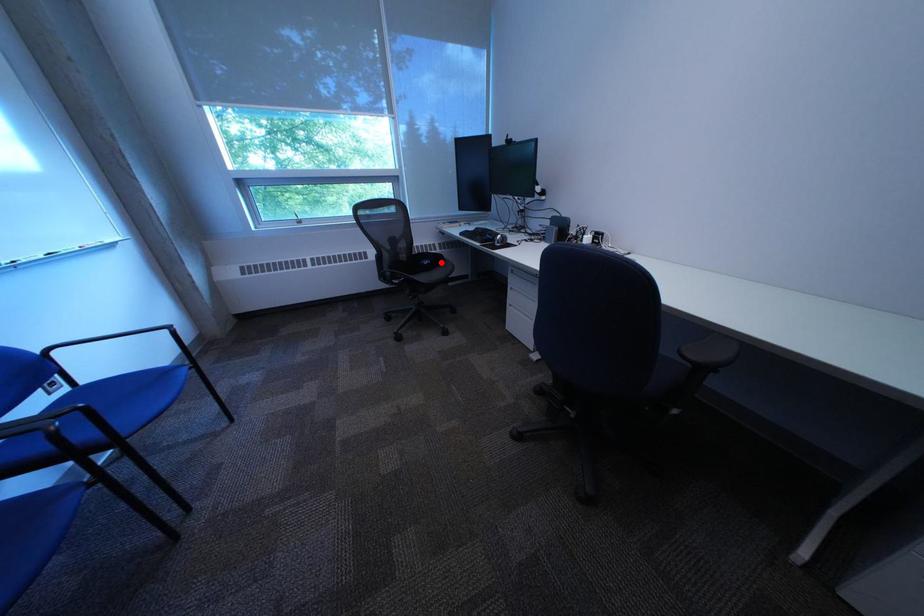
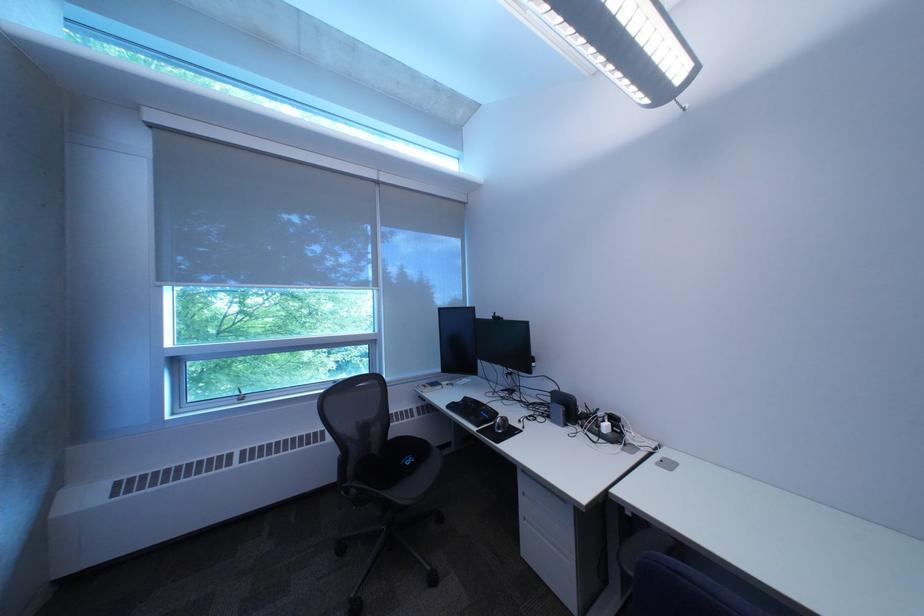
Find the pixel in the second image that matches the highlighted location in the first image.

(423, 461)